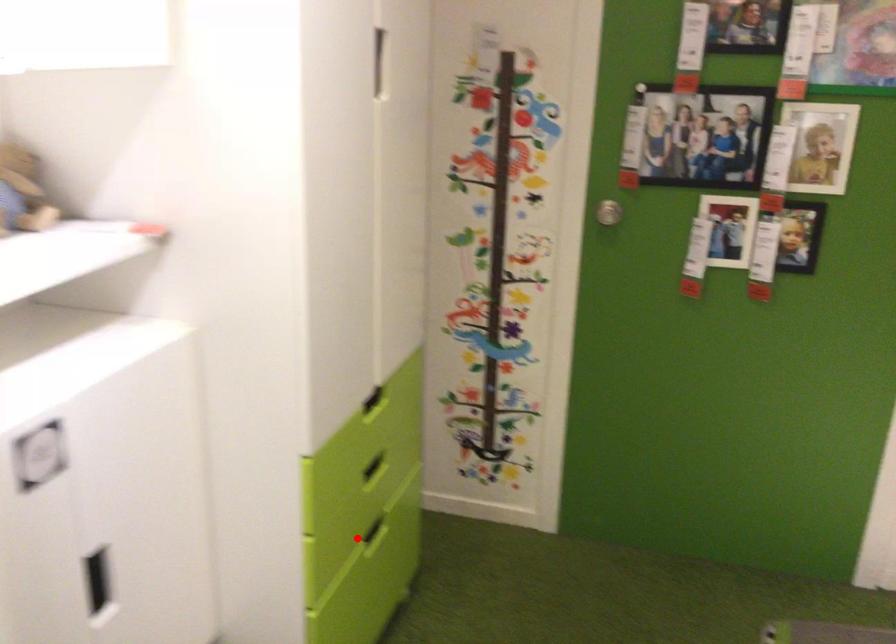
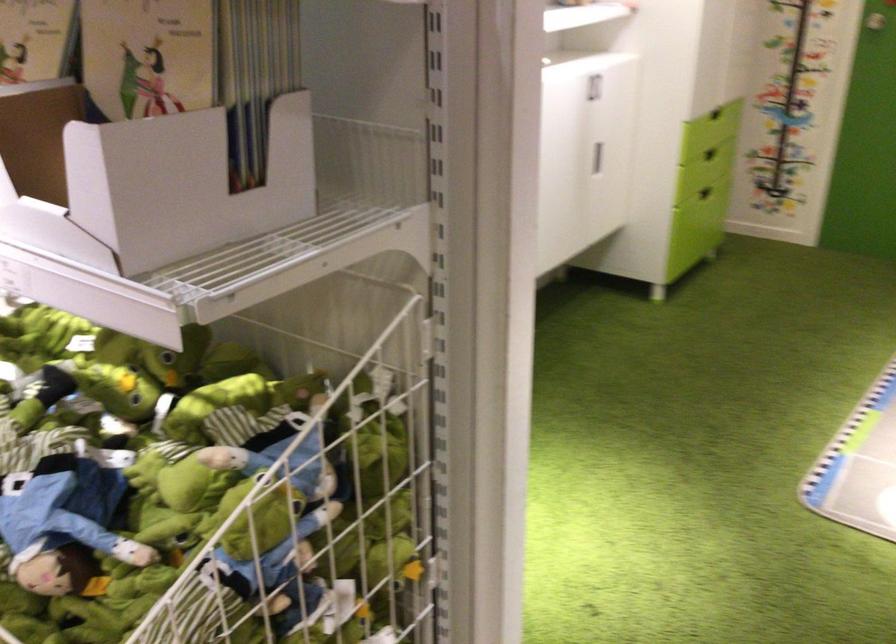
Question: A red point is marked in image1. In image2, is the corresponding 3D point closer to the camera or farther? Reply with the corresponding letter.

Choices:
 (A) The corresponding 3D point is closer.
 (B) The corresponding 3D point is farther.

Answer: (B)